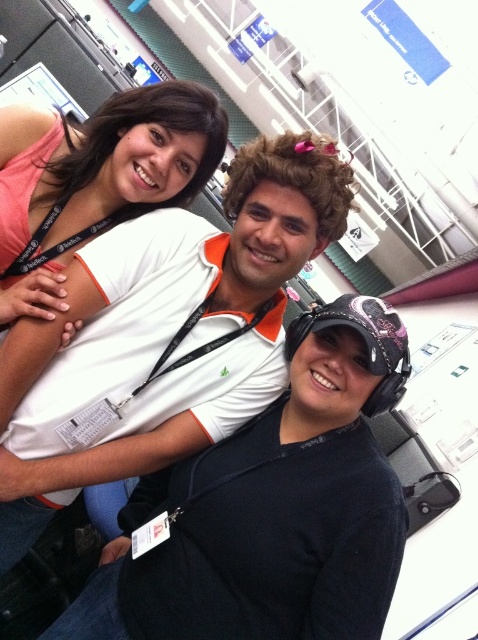
Question: From the image, what is the correct spatial relationship of black matte cap at center in relation to matte pink tank top at upper left?

Choices:
 (A) left
 (B) right

Answer: (B)

Question: Which object appears farthest from the camera in this image?

Choices:
 (A) white matte polo shirt at center
 (B) matte pink tank top at upper left
 (C) black matte cap at center

Answer: (B)

Question: Estimate the real-world distances between objects in this image. Which object is closer to the white matte polo shirt at center?

Choices:
 (A) matte pink tank top at upper left
 (B) black matte cap at center

Answer: (A)

Question: Which point appears closest to the camera in this image?

Choices:
 (A) click(x=236, y=211)
 (B) click(x=26, y=269)
 (C) click(x=393, y=476)

Answer: (C)

Question: Does white matte polo shirt at center have a greater width compared to matte pink tank top at upper left?

Choices:
 (A) yes
 (B) no

Answer: (A)

Question: Is black matte cap at center further to camera compared to matte pink tank top at upper left?

Choices:
 (A) yes
 (B) no

Answer: (B)